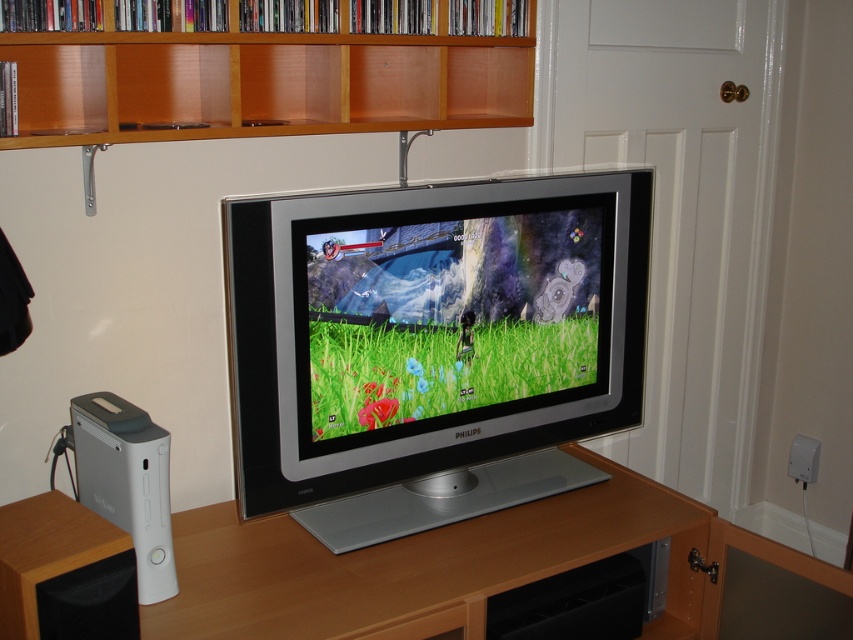
Question: Is wooden at upper center in front of brown wood speaker at lower left?

Choices:
 (A) yes
 (B) no

Answer: (B)

Question: Does wooden table at center come in front of wooden at upper center?

Choices:
 (A) no
 (B) yes

Answer: (B)

Question: Which object appears closest to the camera in this image?

Choices:
 (A) brown wood speaker at lower left
 (B) silver metallic television at center
 (C) wooden at upper center

Answer: (A)

Question: Which is nearer to the wooden table at center?

Choices:
 (A) brown wood speaker at lower left
 (B) silver metallic television at center
 (C) wooden at upper center

Answer: (B)

Question: Where is silver metallic television at center located in relation to brown wood speaker at lower left in the image?

Choices:
 (A) below
 (B) above

Answer: (B)

Question: Estimate the real-world distances between objects in this image. Which object is farther from the wooden at upper center?

Choices:
 (A) silver metallic television at center
 (B) brown wood speaker at lower left
 (C) wooden table at center

Answer: (C)